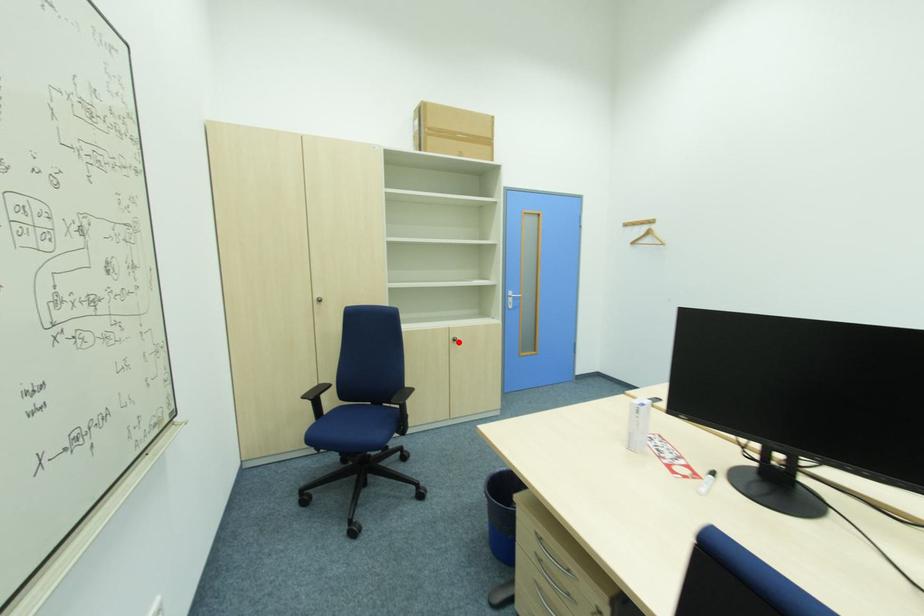
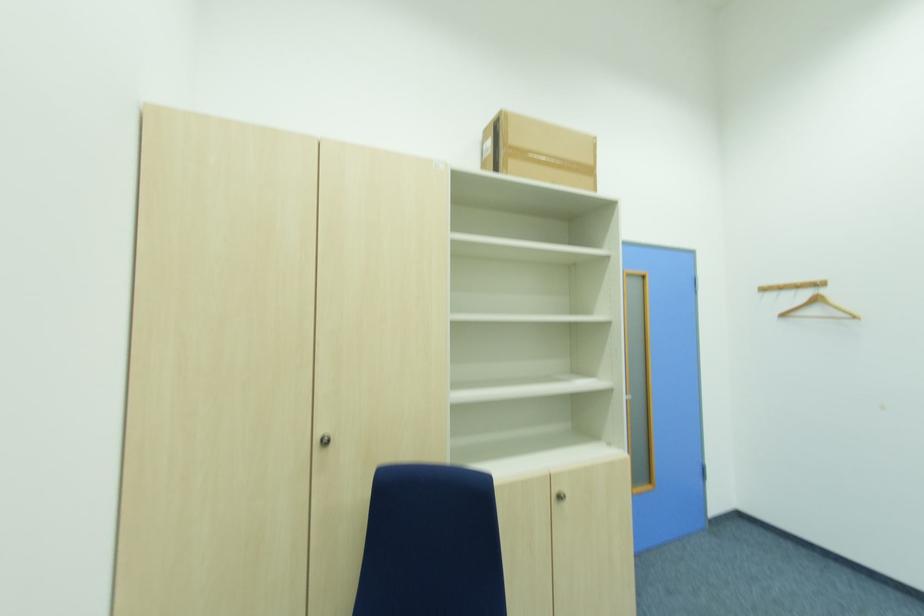
In the second image, find the point that corresponds to the highlighted location in the first image.

(564, 499)